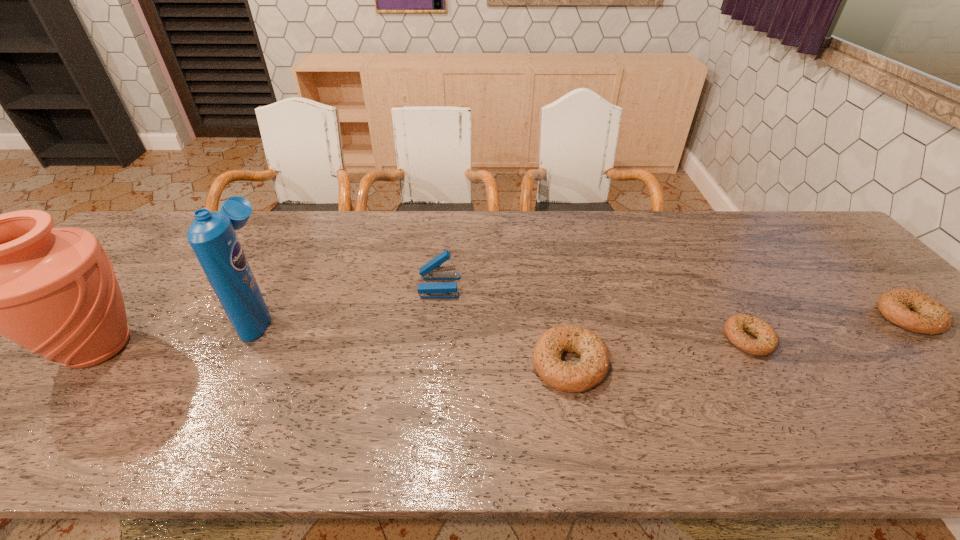
Image resolution: width=960 pixels, height=540 pixels. I want to click on vacant region at the right edge, so click(865, 329).

In order to click on vacant space at the far left corner in this screenshot , I will do `click(122, 252)`.

I want to click on unoccupied position between the vase and the second bagel from left to right, so click(423, 343).

The image size is (960, 540). I want to click on empty space between the shortest bagel and the second object from left to right, so click(505, 327).

Where is `vacant area that lies between the tallest bagel and the shampoo`? This screenshot has height=540, width=960. vacant area that lies between the tallest bagel and the shampoo is located at coordinates (416, 339).

I want to click on free spot between the third object from left to right and the fifth object from right to left, so click(350, 300).

Image resolution: width=960 pixels, height=540 pixels. In order to click on vacant area between the vase and the second object from left to right in this screenshot , I will do `click(180, 330)`.

In order to click on object that can be found as the second closest to the second object from left to right in this screenshot , I will do `click(432, 270)`.

The width and height of the screenshot is (960, 540). Find the location of `the fourth closest object to the shampoo`. the fourth closest object to the shampoo is located at coordinates (767, 341).

Point out which bagel is positioned as the second nearest to the third tallest object. Please provide its 2D coordinates. Your answer should be formatted as a tuple, i.e. [(x, y)], where the tuple contains the x and y coordinates of a point satisfying the conditions above.

[(767, 341)]